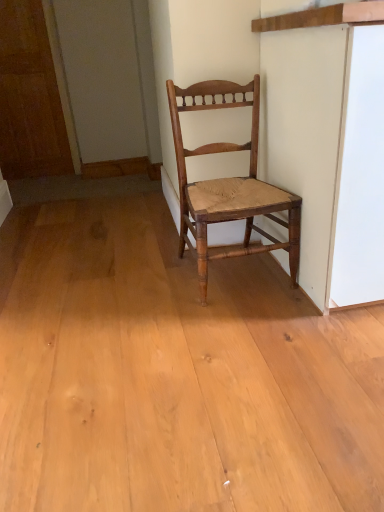
Question: From the image's perspective, relative to natural wood chair at center, is wooden door at left above or below?

Choices:
 (A) above
 (B) below

Answer: (A)

Question: From a real-world perspective, is wooden door at left positioned above or below natural wood chair at center?

Choices:
 (A) above
 (B) below

Answer: (A)

Question: Is wooden door at left situated inside natural wood chair at center or outside?

Choices:
 (A) inside
 (B) outside

Answer: (B)

Question: Does point coord(248,248) appear closer or farther from the camera than point coord(38,102)?

Choices:
 (A) closer
 (B) farther

Answer: (A)

Question: In terms of width, does natural wood chair at center look wider or thinner when compared to wooden door at left?

Choices:
 (A) thin
 (B) wide

Answer: (B)

Question: From a real-world perspective, is natural wood chair at center positioned above or below wooden door at left?

Choices:
 (A) below
 (B) above

Answer: (A)

Question: In terms of height, does natural wood chair at center look taller or shorter compared to wooden door at left?

Choices:
 (A) tall
 (B) short

Answer: (B)